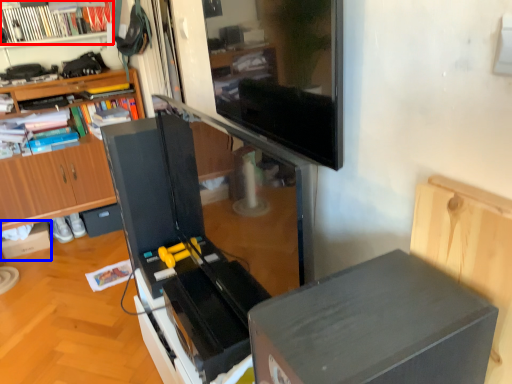
Question: Which object appears farthest to the camera in this image, book (highlighted by a red box) or cardboard box (highlighted by a blue box)?

Choices:
 (A) book
 (B) cardboard box

Answer: (B)